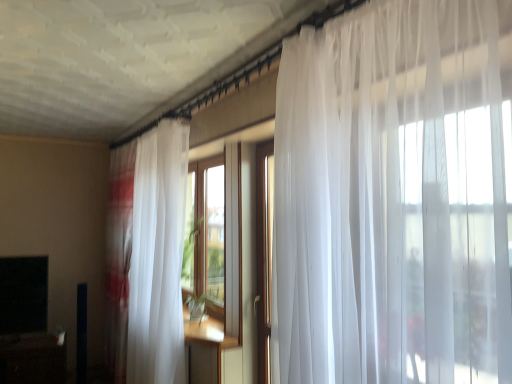
Find the location of `black matte tv at lower left`. black matte tv at lower left is located at coordinates (23, 294).

Locate an element on the screen. This screenshot has height=384, width=512. sheer white curtain at left is located at coordinates (148, 253).

From the picture: Is black matte tv at lower left oriented away from sheer white curtain at left?

No, black matte tv at lower left is not facing the opposite direction of sheer white curtain at left.

Is black matte tv at lower left not close to sheer white curtain at left?

Yes, black matte tv at lower left is far from sheer white curtain at left.

Between black matte tv at lower left and sheer white curtain at left, which one has less height?

Standing shorter between the two is black matte tv at lower left.

Consider the image. Can you confirm if black matte tv at lower left is smaller than sheer white curtain at left?

Yes, black matte tv at lower left is smaller than sheer white curtain at left.

From the picture: From the image's perspective, is black matte tv at lower left on top of black glossy table at lower left?

Yes, from the image's perspective, black matte tv at lower left is on top of black glossy table at lower left.

Considering the sizes of objects black matte tv at lower left and black glossy table at lower left in the image provided, who is wider, black matte tv at lower left or black glossy table at lower left?

With larger width is black glossy table at lower left.

Which is in front, point (30, 314) or point (15, 376)?

The point (15, 376) is closer.

Image resolution: width=512 pixels, height=384 pixels. What are the coordinates of `table in front of the black matte tv at lower left` in the screenshot? It's located at (32, 359).

Are sheer white curtain at left and black glossy table at lower left making contact?

No, sheer white curtain at left is not next to black glossy table at lower left.

Consider the image. From the image's perspective, is sheer white curtain at left below black glossy table at lower left?

No.

Can you tell me how much sheer white curtain at left and black glossy table at lower left differ in facing direction?

They differ by 81.5 degrees in their facing directions.

Considering the positions of point (137, 182) and point (50, 363), is point (137, 182) closer or farther from the camera than point (50, 363)?

Point (137, 182) is farther from the camera than point (50, 363).

Is black matte tv at lower left surrounded by sheer white curtain at left?

No, black matte tv at lower left is not a part of sheer white curtain at left.

Is sheer white curtain at left positioned with its back to black matte tv at lower left?

Yes.

Relative to black matte tv at lower left, is sheer white curtain at left in front or behind?

sheer white curtain at left is in front of black matte tv at lower left.

How many degrees apart are the facing directions of sheer white curtain at left and black matte tv at lower left?

The angle between the facing direction of sheer white curtain at left and the facing direction of black matte tv at lower left is 80.6 degrees.

Considering the relative sizes of black glossy table at lower left and sheer white curtain at left in the image provided, is black glossy table at lower left shorter than sheer white curtain at left?

Indeed, black glossy table at lower left has a lesser height compared to sheer white curtain at left.

Is black glossy table at lower left oriented towards sheer white curtain at left?

No, black glossy table at lower left is not aimed at sheer white curtain at left.

From the image's perspective, which is below, black glossy table at lower left or sheer white curtain at left?

black glossy table at lower left appears lower in the image.

Is black glossy table at lower left shorter than black matte tv at lower left?

Yes, black glossy table at lower left is shorter than black matte tv at lower left.

Which object is closer to the camera, black glossy table at lower left or black matte tv at lower left?

black glossy table at lower left is in front.

Is point (16, 371) farther from camera compared to point (9, 270)?

No.

From a real-world perspective, between black glossy table at lower left and black matte tv at lower left, who is vertically lower?

In real-world perspective, black glossy table at lower left is lower.

The height and width of the screenshot is (384, 512). What are the coordinates of `curtain positioned vertically above the black matte tv at lower left (from a real-world perspective)` in the screenshot? It's located at (148, 253).

Find the location of `table located on the right of black matte tv at lower left`. table located on the right of black matte tv at lower left is located at coordinates (32, 359).

Which object lies nearer to the anchor point black glossy table at lower left, sheer white curtain at left or black matte tv at lower left?

black matte tv at lower left is positioned closer to the anchor black glossy table at lower left.

When comparing their distances from black matte tv at lower left, does black glossy table at lower left or sheer white curtain at left seem closer?

black glossy table at lower left.

From the image, which object appears to be farther from sheer white curtain at left, black matte tv at lower left or black glossy table at lower left?

black glossy table at lower left lies further to sheer white curtain at left than the other object.

Estimate the real-world distances between objects in this image. Which object is closer to black glossy table at lower left, black matte tv at lower left or sheer white curtain at left?

black matte tv at lower left.

Which object lies further to the anchor point sheer white curtain at left, black glossy table at lower left or black matte tv at lower left?

Based on the image, black glossy table at lower left appears to be further to sheer white curtain at left.

Estimate the real-world distances between objects in this image. Which object is closer to black matte tv at lower left, sheer white curtain at left or black glossy table at lower left?

black glossy table at lower left is closer to black matte tv at lower left.

What are the coordinates of `table located between black matte tv at lower left and sheer white curtain at left in the left-right direction` in the screenshot? It's located at (32, 359).